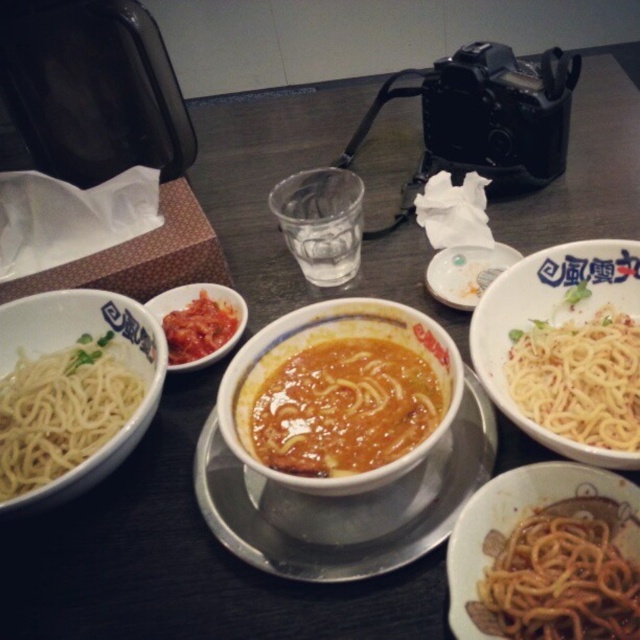
Is point (307, 316) closer to viewer compared to point (177, 342)?

Yes, point (307, 316) is closer to viewer.

Can you confirm if matte ceramic bowl at center is positioned above tomato paste at center?

No.

What do you see at coordinates (323, 340) in the screenshot?
I see `matte ceramic bowl at center` at bounding box center [323, 340].

Image resolution: width=640 pixels, height=640 pixels. I want to click on matte ceramic bowl at center, so click(323, 340).

Between white matte noodles at left and white matte spaghetti at right, which one has more height?

white matte noodles at left is taller.

Which is more to the right, white matte noodles at left or white matte spaghetti at right?

From the viewer's perspective, white matte spaghetti at right appears more on the right side.

Who is more forward, (x=28, y=426) or (x=538, y=332)?

Positioned in front is point (x=28, y=426).

The image size is (640, 640). I want to click on white matte noodles at left, so [x=72, y=392].

Who is shorter, brown matte noodles at lower right or matte ceramic bowl at center?

Standing shorter between the two is brown matte noodles at lower right.

Which is in front, point (513, 492) or point (362, 470)?

Positioned in front is point (513, 492).

Is point (524, 515) behind point (259, 355)?

No.

Where is `brown matte noodles at lower right`? brown matte noodles at lower right is located at coordinates (547, 556).